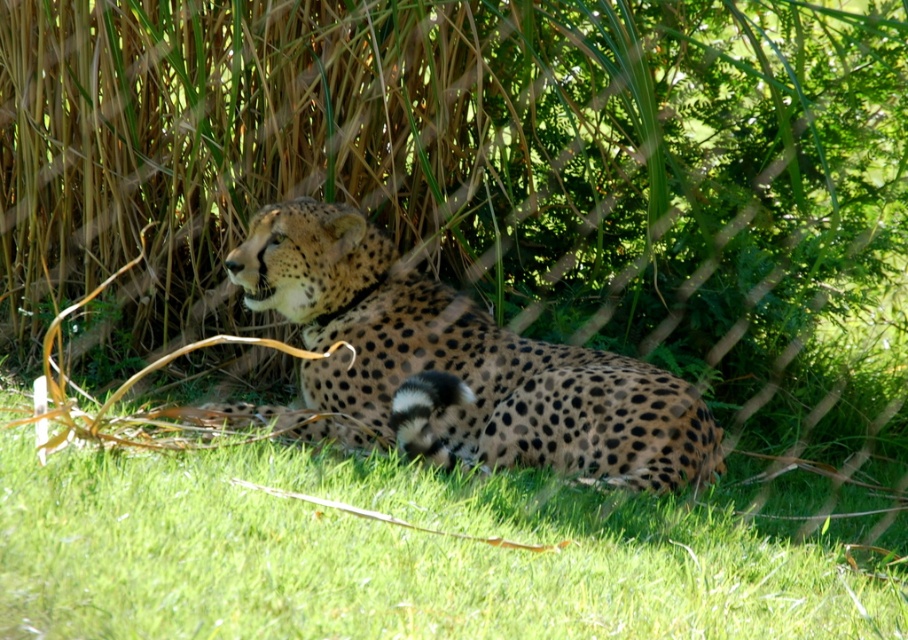
You are a wildlife photographer aiming to capture the spotted fur cheetah at center in your frame. Given the green grass at lower center is blocking part of the cheetah, can you determine if the grass is bigger than the cheetah?

The green grass at lower center is larger in size than the spotted fur cheetah at center, so the grass is bigger and might block the cheetah more significantly.

You are a photographer trying to capture the cheetah in the image. You need to position your camera so that the green grass at lower center is exactly at the center of your viewfinder. What adjustment should you make to the camera position?

Since the green grass at lower center is located at point 0.867 on the x axis and 0.431 on the y axis, you should move the camera to the left and upwards to bring the green grass at lower center to the center of the viewfinder.